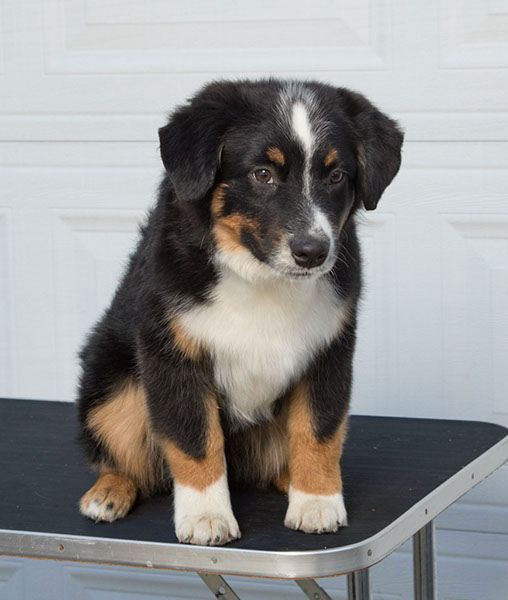
Where is `chest`? This screenshot has width=508, height=600. chest is located at coordinates (266, 347).